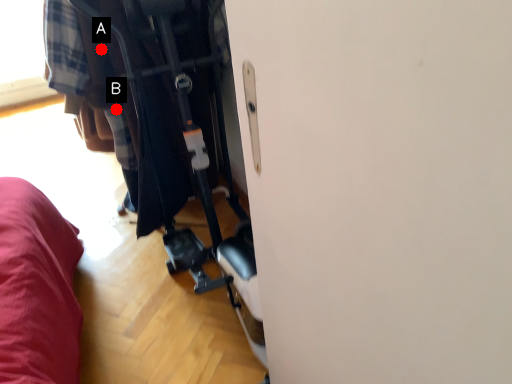
Question: Two points are circled on the image, labeled by A and B beside each circle. Which point is closer to the camera taking this photo?

Choices:
 (A) A is closer
 (B) B is closer

Answer: (A)